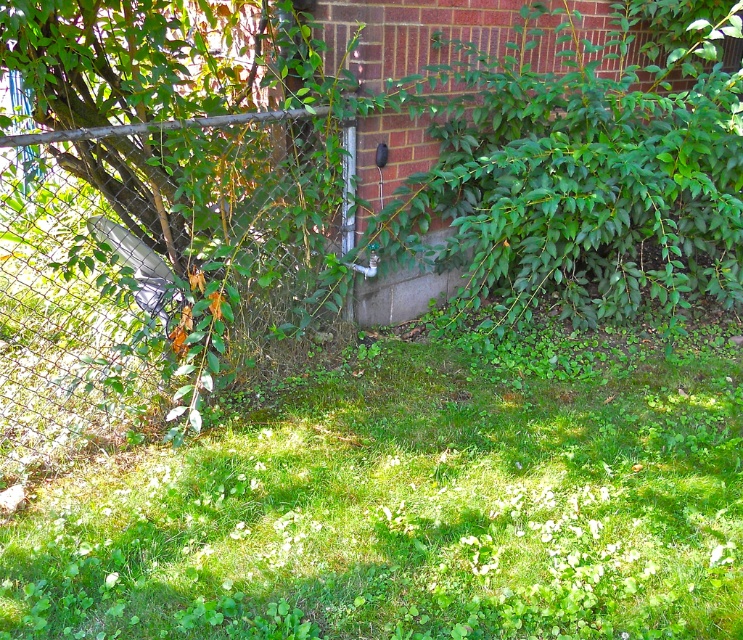
Question: Does green grass at lower center have a smaller size compared to metallic chain-link fence at left?

Choices:
 (A) no
 (B) yes

Answer: (A)

Question: Is green grass at lower center further to camera compared to metallic chain-link fence at left?

Choices:
 (A) no
 (B) yes

Answer: (A)

Question: Which object appears farthest from the camera in this image?

Choices:
 (A) metallic chain-link fence at left
 (B) green grass at lower center

Answer: (A)

Question: Can you confirm if green grass at lower center is wider than metallic chain-link fence at left?

Choices:
 (A) yes
 (B) no

Answer: (A)

Question: Which object appears farthest from the camera in this image?

Choices:
 (A) green grass at lower center
 (B) metallic chain-link fence at left

Answer: (B)